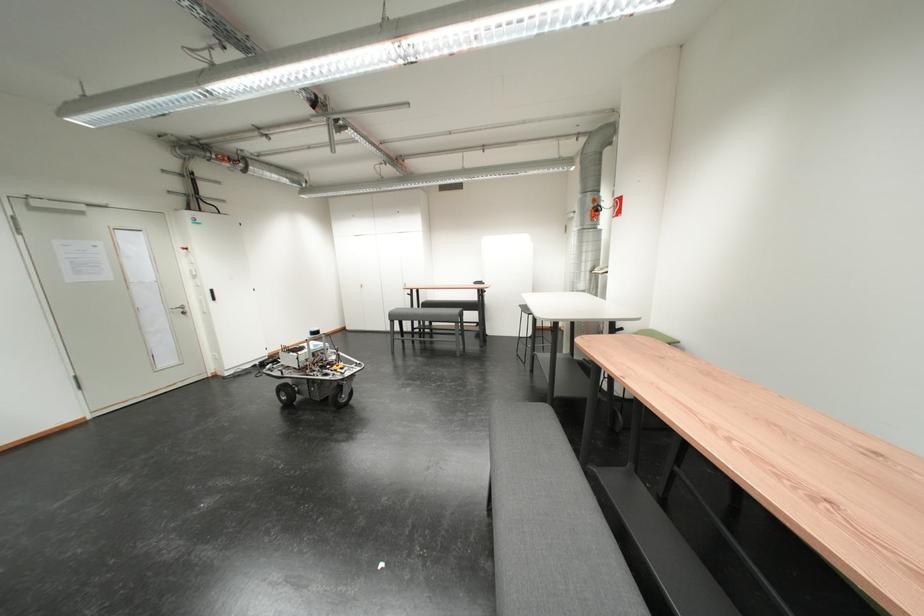
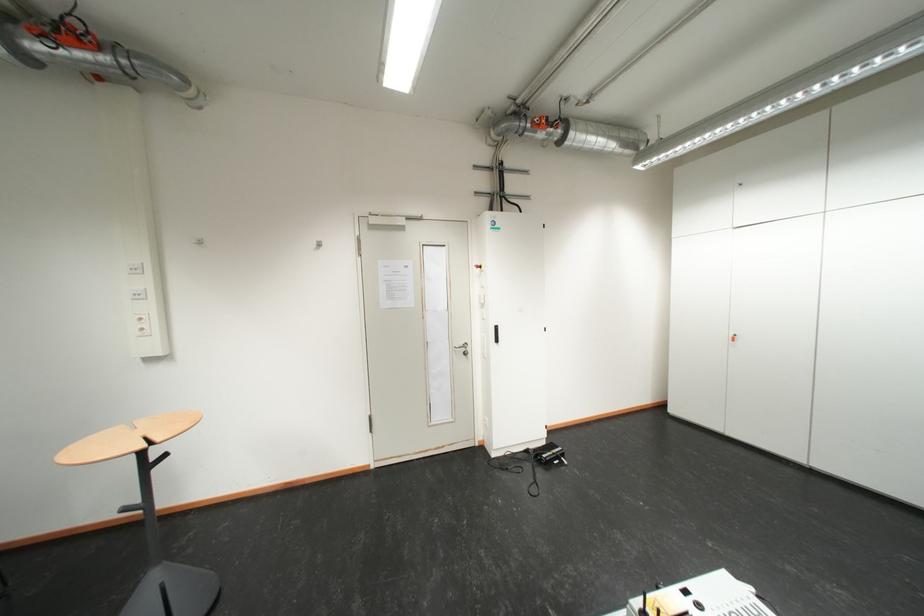
In the second image, find the point that corresponds to (224,293) in the first image.

(507, 330)